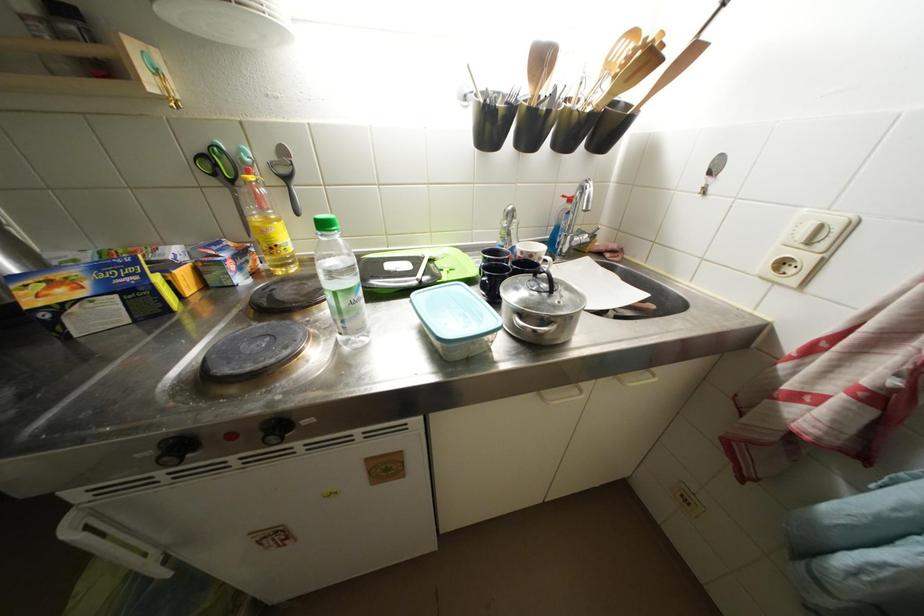
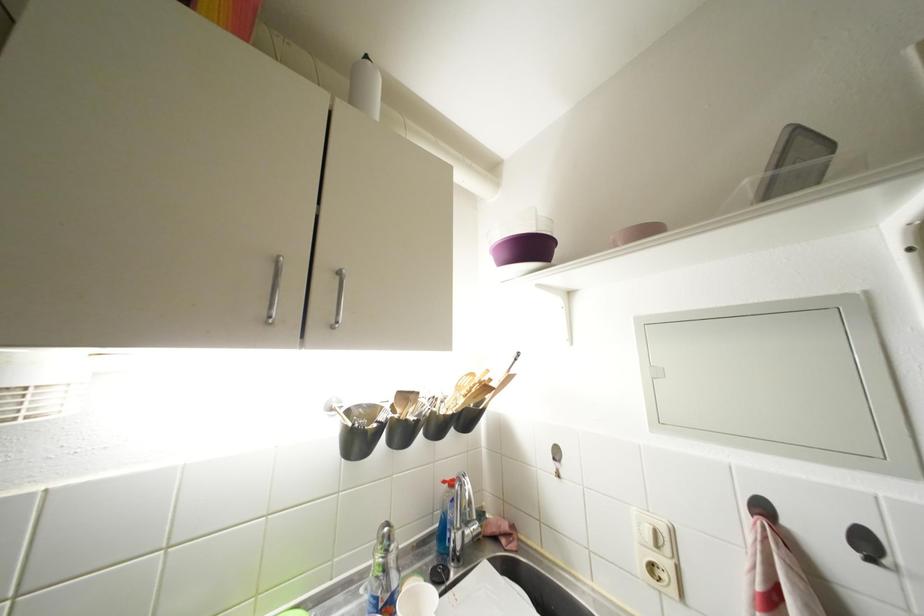
The point at (709, 185) is marked in the first image. Where is the corresponding point in the second image?

(560, 469)